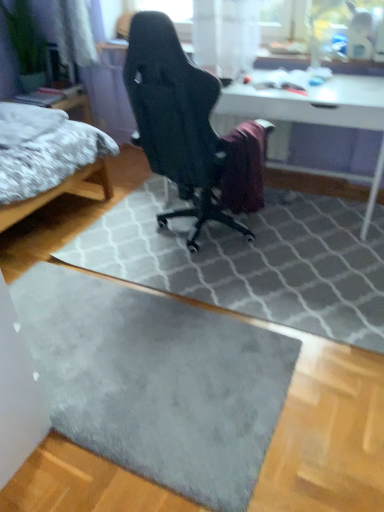
Locate an element on the screen. This screenshot has width=384, height=512. vacant space situated above gray soft rug at lower center (from a real-world perspective) is located at coordinates pyautogui.click(x=124, y=372).